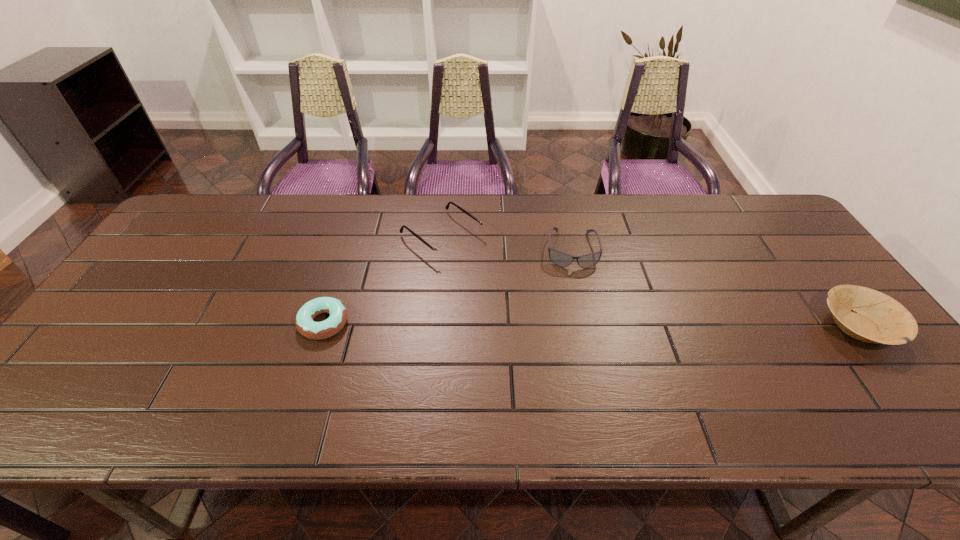
You are a GUI agent. You are given a task and a screenshot of the screen. Output one action in this format:
    pyautogui.click(x=<x>, y=<y>)
    Task: Click on the free space located 0.240m on the lenses of the third object from left to right
    This screenshot has height=540, width=960.
    Given the screenshot: What is the action you would take?
    pyautogui.click(x=578, y=338)

The width and height of the screenshot is (960, 540). I want to click on vacant point located 0.290m on the lenses of the third object from left to right, so click(580, 355).

Find the location of a particular element. The height and width of the screenshot is (540, 960). free region located 0.080m on the lenses of the third object from left to right is located at coordinates (575, 291).

At what (x,y) coordinates should I click in order to perform the action: click on spectacles at the far edge. Please return your answer as a coordinate pair (x, y). The image size is (960, 540). Looking at the image, I should click on (443, 251).

The width and height of the screenshot is (960, 540). What are the coordinates of `sunglasses that is at the far edge` in the screenshot? It's located at click(x=559, y=258).

Locate an element on the screen. The width and height of the screenshot is (960, 540). object present at the right edge is located at coordinates (876, 318).

In the image, there is a desktop. Where is `blank space at the far edge`? blank space at the far edge is located at coordinates (605, 202).

I want to click on vacant region at the near edge of the desktop, so click(x=741, y=379).

Identify the location of free space at the left edge. (176, 281).

I want to click on blank space at the right edge of the desktop, so click(810, 312).